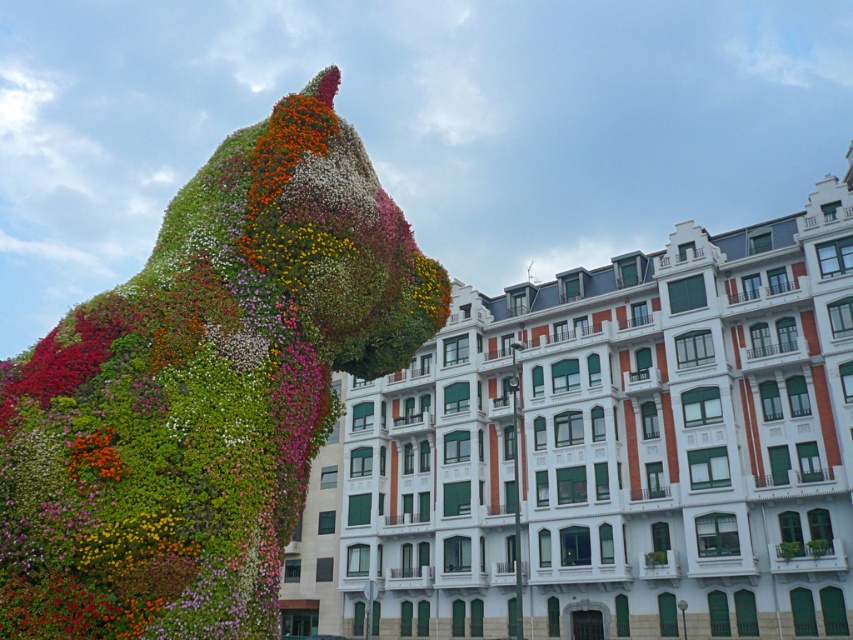
You are an architect analyzing the spatial relationship between the white stone building at center and the fluffy floral sculpture at upper left. Based on the scene, which object is positioned further away from the viewer?

The fluffy floral sculpture at upper left is behind the white stone building at center, so it is positioned further away from the viewer than the building.

What is the significance of the point marked at coordinates (621,448) in the image?

The point marked at coordinates (621,448) indicates the location of the white stone building at the center of the image.

You are an architect designing a new garden layout. You need to place a pathway between the white stone building at center and the fluffy floral sculpture at upper left. Based on their widths, which side of the pathway should be closer to the building to ensure stability?

The white stone building at center might be wider than the fluffy floral sculpture at upper left, so the pathway should be closer to the sculpture to maintain stability, as wider structures typically require more support on their sides.